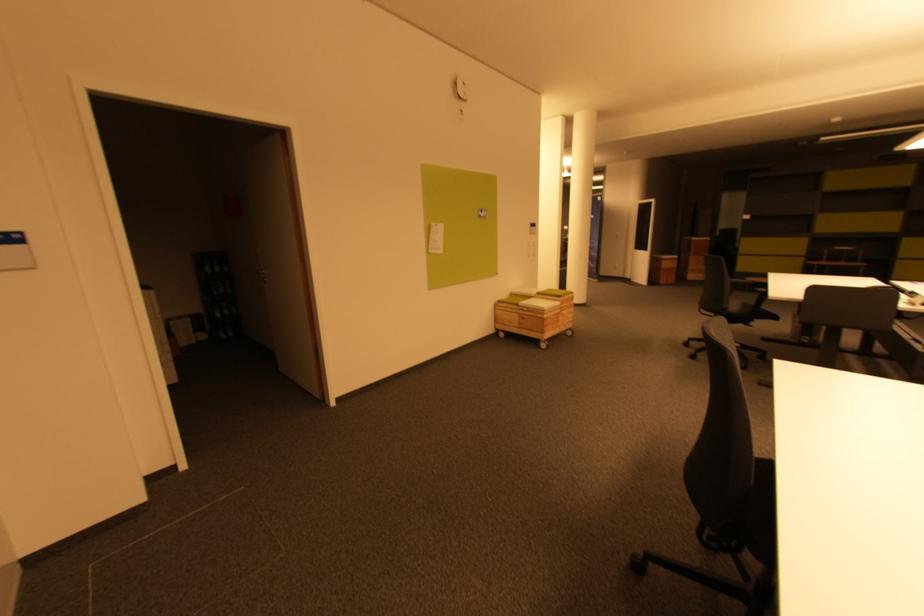
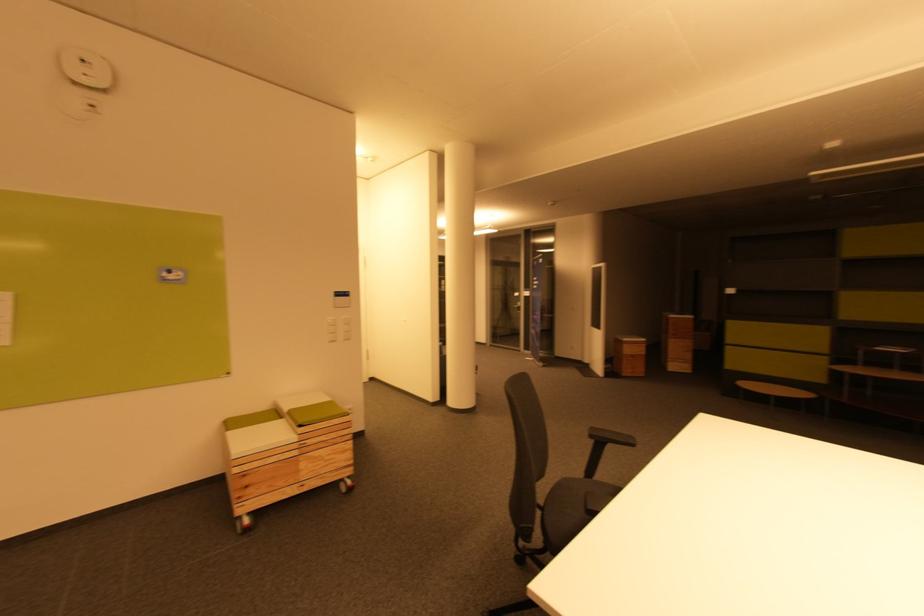
In a continuous first-person perspective shot, in which direction is the camera moving?

The cameraman walked toward right, forward.